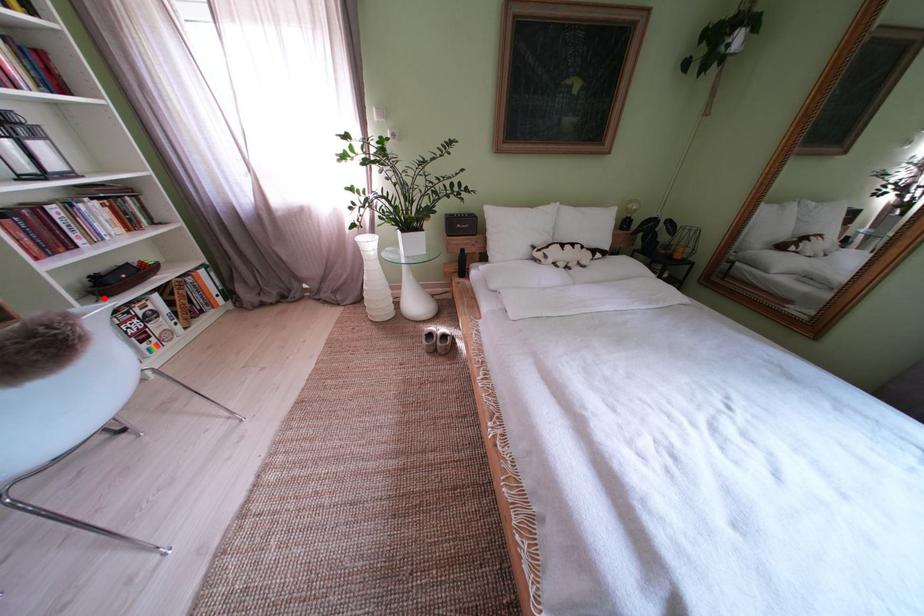
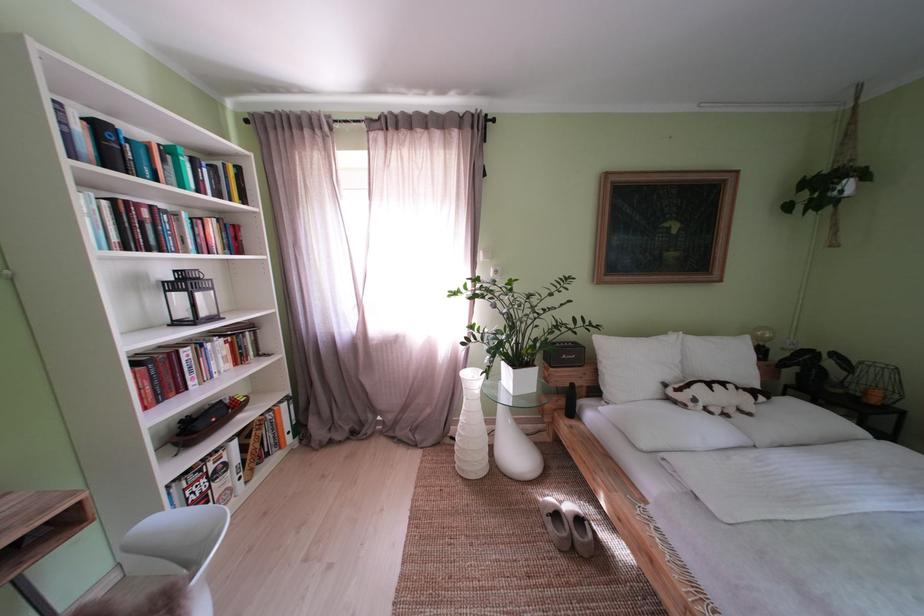
Locate, in the second image, the point that corresponds to the highlighted location in the first image.

(187, 450)